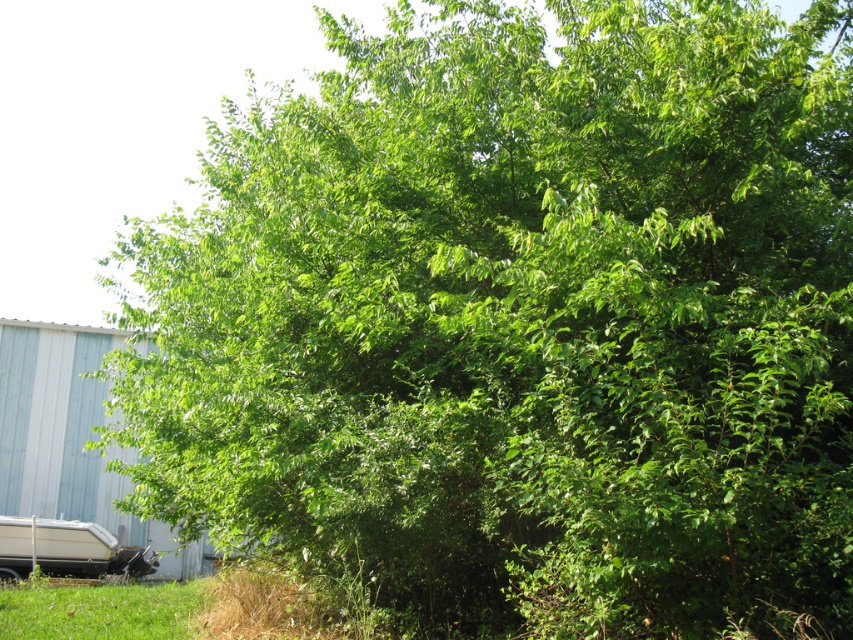
Question: Which object is closer to the camera taking this photo?

Choices:
 (A) white glossy boat at lower left
 (B) green grass at lower left

Answer: (B)

Question: Is green grass at lower left bigger than white glossy boat at lower left?

Choices:
 (A) yes
 (B) no

Answer: (B)

Question: Is green grass at lower left to the right of white glossy boat at lower left from the viewer's perspective?

Choices:
 (A) no
 (B) yes

Answer: (B)

Question: Does green grass at lower left come in front of white glossy boat at lower left?

Choices:
 (A) yes
 (B) no

Answer: (A)

Question: Which object appears closest to the camera in this image?

Choices:
 (A) white glossy boat at lower left
 (B) green grass at lower left

Answer: (B)

Question: Which of the following is the closest to the observer?

Choices:
 (A) (102, 557)
 (B) (155, 602)

Answer: (B)